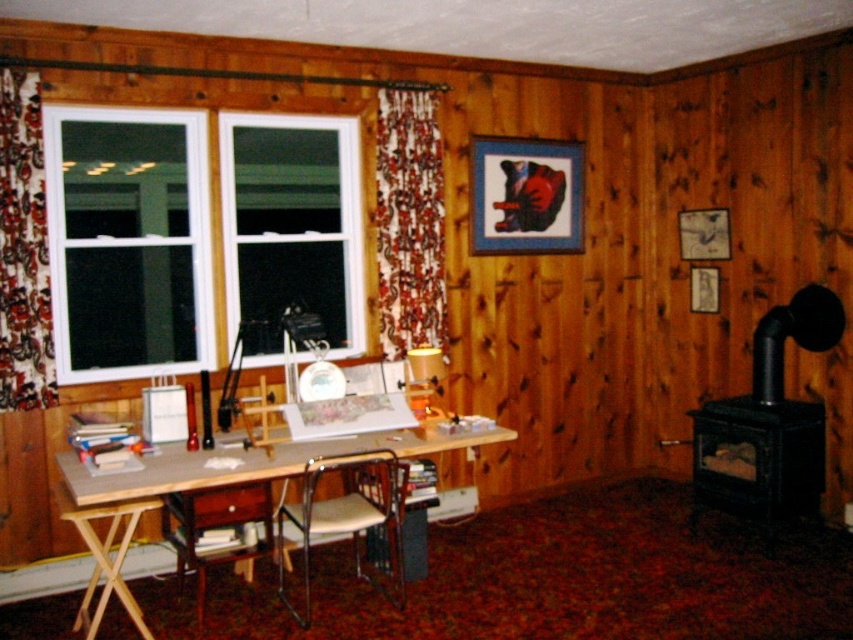
Question: Which point is farther to the camera?

Choices:
 (A) floral fabric curtain at left
 (B) metallic silver picture frame at upper right
 (C) light brown wooden table at lower left
 (D) wooden picture frame at upper right

Answer: (D)

Question: Does white plastic window at left have a larger size compared to floral fabric curtain at left?

Choices:
 (A) no
 (B) yes

Answer: (B)

Question: Which point is farther to the camera?

Choices:
 (A) metallic silver chair at center
 (B) white glass window at upper left
 (C) wooden picture frame at upper center

Answer: (C)

Question: Is white plastic window at left to the right of metallic silver chair at center from the viewer's perspective?

Choices:
 (A) yes
 (B) no

Answer: (B)

Question: Estimate the real-world distances between objects in this image. Which object is closer to the metallic silver chair at center?

Choices:
 (A) wooden picture frame at upper center
 (B) brown wood chair at lower left

Answer: (B)

Question: Does light brown wooden table at lower left have a smaller size compared to brown wood chair at lower left?

Choices:
 (A) no
 (B) yes

Answer: (A)